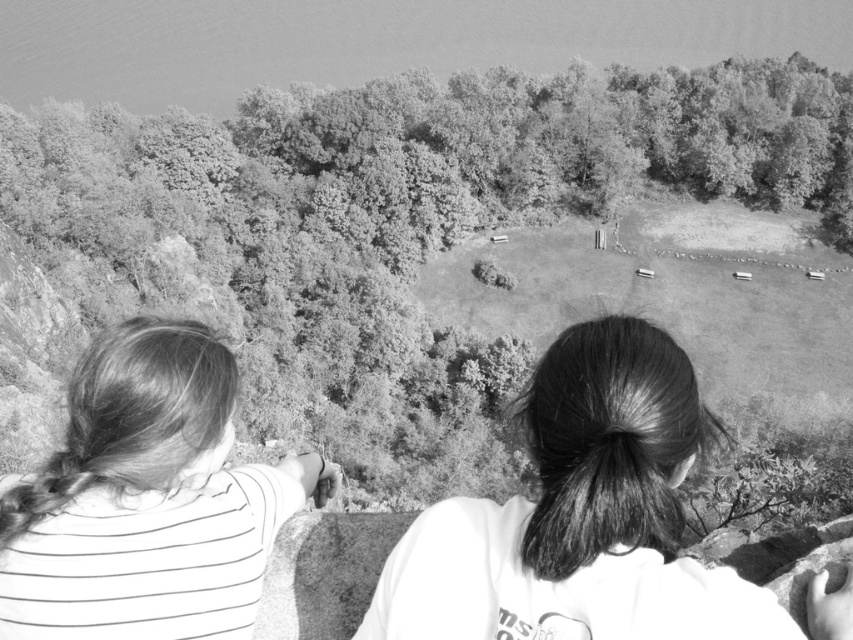
In the scene shown: Does white t-shirt at center have a lesser height compared to striped fabric hair at left?

No.

Is white t-shirt at center below striped fabric hair at left?

No, white t-shirt at center is not below striped fabric hair at left.

Is point (544, 371) positioned in front of point (138, 564)?

Yes, it is in front of point (138, 564).

I want to click on white t-shirt at center, so click(581, 515).

Based on the photo, does smooth green tree at center have a greater height compared to white t-shirt at center?

Indeed, smooth green tree at center has a greater height compared to white t-shirt at center.

This screenshot has width=853, height=640. In order to click on smooth green tree at center in this screenshot , I will do `click(397, 195)`.

Who is more forward, (x=222, y=131) or (x=96, y=403)?

Point (x=96, y=403)

From the picture: Does smooth green tree at center have a greater width compared to striped fabric hair at left?

Indeed, smooth green tree at center has a greater width compared to striped fabric hair at left.

Who is more forward, (569, 148) or (67, 541)?

Positioned in front is point (67, 541).

At what (x,y) coordinates should I click in order to perform the action: click on smooth green tree at center. Please return your answer as a coordinate pair (x, y). Looking at the image, I should click on (397, 195).